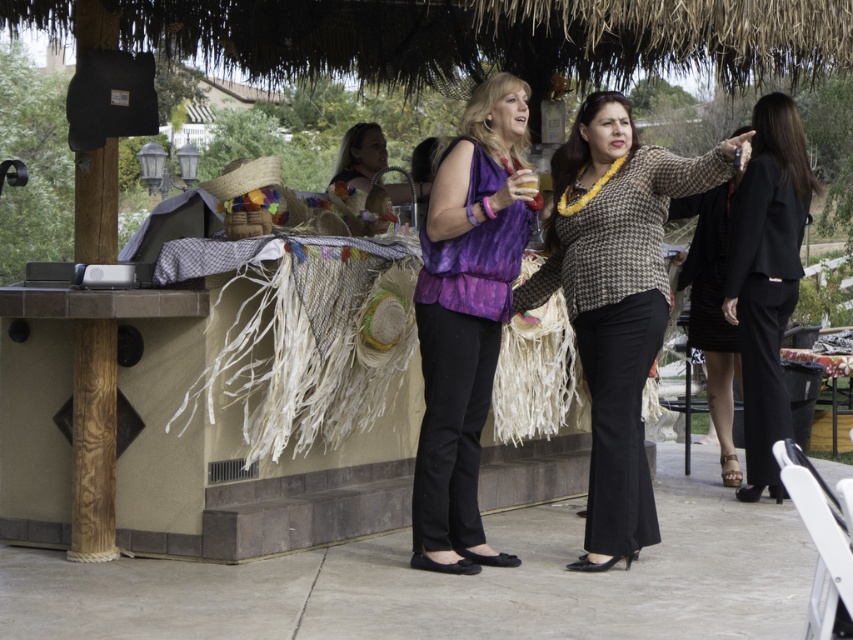
Question: Among these objects, which one is farthest from the camera?

Choices:
 (A) houndstooth fabric blouse at center
 (B) black matte suit at right

Answer: (B)

Question: Which point is farther from the camera taking this photo?

Choices:
 (A) (772, 177)
 (B) (648, 214)

Answer: (A)

Question: Based on their relative distances, which object is farther from the houndstooth fabric blouse at center?

Choices:
 (A) black matte suit at right
 (B) purple silky blouse at center

Answer: (A)

Question: Does houndstooth fabric blouse at center appear on the left side of black matte suit at right?

Choices:
 (A) yes
 (B) no

Answer: (A)

Question: Can you confirm if houndstooth fabric blouse at center is thinner than black matte suit at right?

Choices:
 (A) yes
 (B) no

Answer: (B)

Question: Can you confirm if houndstooth fabric blouse at center is wider than black matte suit at right?

Choices:
 (A) yes
 (B) no

Answer: (A)